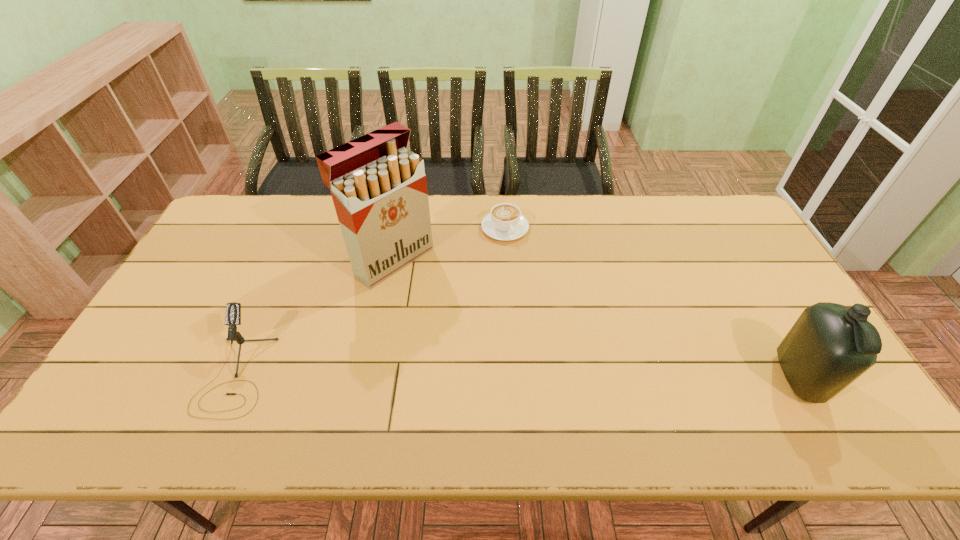
Find the location of a particular element. This screenshot has width=960, height=540. free space between the second shortest object and the second object from left to right is located at coordinates (314, 318).

Locate an element on the screen. free area in between the third object from right to left and the cappuccino is located at coordinates (448, 244).

Where is `free space between the shortest object and the tallest object`? The height and width of the screenshot is (540, 960). free space between the shortest object and the tallest object is located at coordinates (448, 244).

This screenshot has width=960, height=540. I want to click on vacant space that is in between the shortest object and the microphone, so click(371, 301).

The image size is (960, 540). What are the coordinates of `free space between the shortest object and the third object from right to left` in the screenshot? It's located at (448, 244).

Locate which object ranks in proximity to the third object from right to left. Please provide its 2D coordinates. Your answer should be formatted as a tuple, i.e. [(x, y)], where the tuple contains the x and y coordinates of a point satisfying the conditions above.

[(505, 222)]

I want to click on object that stands as the second closest to the tallest object, so click(x=233, y=310).

This screenshot has width=960, height=540. Find the location of `vacant space that satisfies the following two spatial constraints: 1. on the stand of the bottle; 2. on the right side of the third tallest object`. vacant space that satisfies the following two spatial constraints: 1. on the stand of the bottle; 2. on the right side of the third tallest object is located at coordinates click(234, 378).

Locate an element on the screen. Image resolution: width=960 pixels, height=540 pixels. vacant point that satisfies the following two spatial constraints: 1. on the front side of the cappuccino; 2. on the left side of the bottle is located at coordinates (514, 378).

You are a GUI agent. You are given a task and a screenshot of the screen. Output one action in this format:
    pyautogui.click(x=<x>, y=<y>)
    Task: Click on the free space that satisfies the following two spatial constraints: 1. on the stand of the rightmost object; 2. on the left side of the third tallest object
    Image resolution: width=960 pixels, height=540 pixels.
    Given the screenshot: What is the action you would take?
    [234, 378]